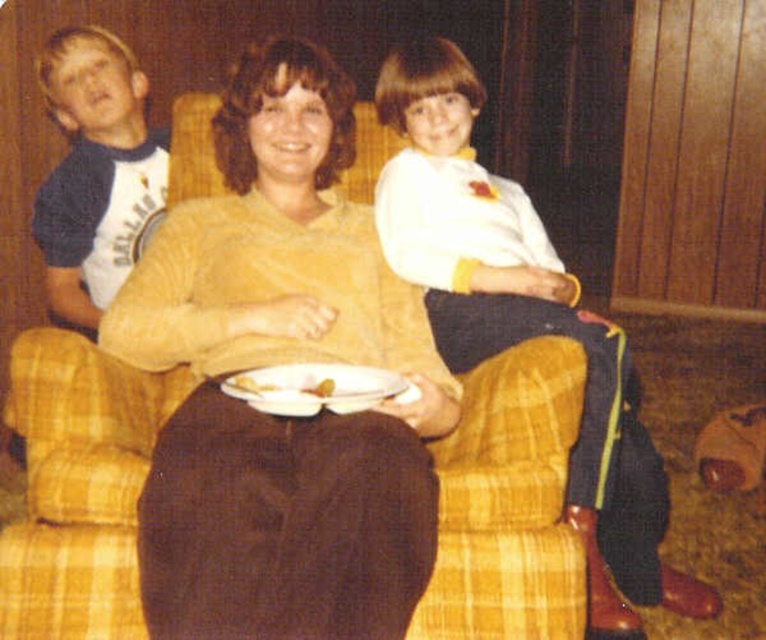
Can you confirm if blue-gray jersey at left is positioned below white glossy plate at center?

Incorrect, blue-gray jersey at left is not positioned below white glossy plate at center.

Is point (87, 257) behind point (313, 371)?

Yes, point (87, 257) is farther from viewer.

Does point (57, 314) lie in front of point (260, 392)?

That is False.

Where is `blue-gray jersey at left`? The height and width of the screenshot is (640, 766). blue-gray jersey at left is located at coordinates (95, 173).

Can you confirm if white cotton shirt at upper right is thinner than white glossy plate at center?

In fact, white cotton shirt at upper right might be wider than white glossy plate at center.

At what (x,y) coordinates should I click in order to perform the action: click on white cotton shirt at upper right. Please return your answer as a coordinate pair (x, y). The image size is (766, 640). Looking at the image, I should click on (522, 323).

Image resolution: width=766 pixels, height=640 pixels. Describe the element at coordinates (522, 323) in the screenshot. I see `white cotton shirt at upper right` at that location.

Find the location of `white cotton shirt at upper right`. white cotton shirt at upper right is located at coordinates (522, 323).

Is point (447, 49) positioned after point (71, 250)?

No, (447, 49) is in front of (71, 250).

Is white cotton shirt at upper right taller than blue-gray jersey at left?

Correct, white cotton shirt at upper right is much taller as blue-gray jersey at left.

The image size is (766, 640). I want to click on white cotton shirt at upper right, so click(x=522, y=323).